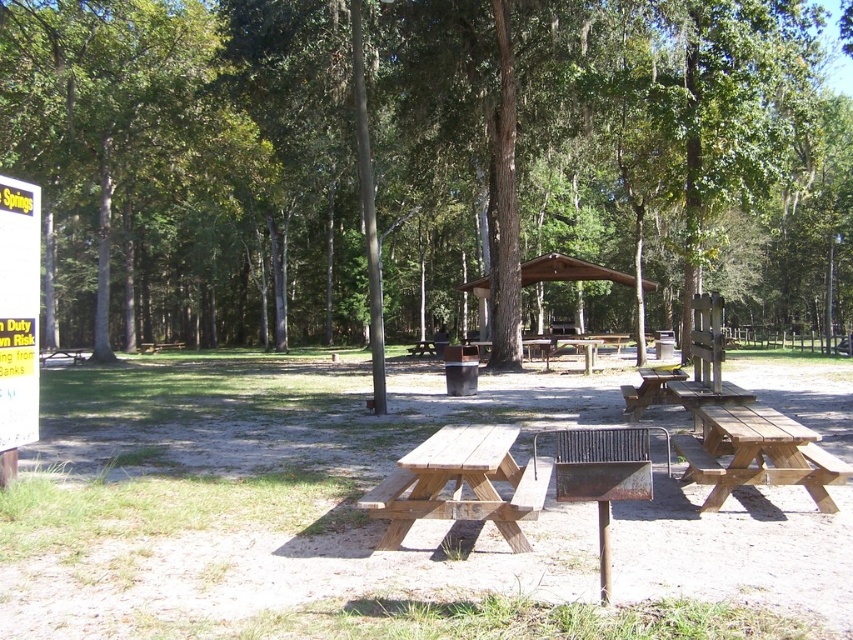
Who is lower down, brown wood tree at center or green leafy tree at left?

green leafy tree at left is below.

Can you confirm if brown wood tree at center is positioned to the right of green leafy tree at left?

Yes, brown wood tree at center is to the right of green leafy tree at left.

The height and width of the screenshot is (640, 853). What do you see at coordinates (422, 163) in the screenshot?
I see `brown wood tree at center` at bounding box center [422, 163].

Identify the location of brown wood tree at center. The image size is (853, 640). (422, 163).

Is point (488, 442) closer to viewer compared to point (706, 502)?

That is True.

You are a GUI agent. You are given a task and a screenshot of the screen. Output one action in this format:
    pyautogui.click(x=<x>, y=<y>)
    Task: Click on the natural wood picnic table at center
    
    Given the screenshot: What is the action you would take?
    pyautogui.click(x=460, y=483)

What do you see at coordinates (422, 163) in the screenshot?
I see `brown wood tree at center` at bounding box center [422, 163].

Which is below, brown wood tree at center or natural wood picnic table at center?

natural wood picnic table at center

Image resolution: width=853 pixels, height=640 pixels. What do you see at coordinates (422, 163) in the screenshot?
I see `brown wood tree at center` at bounding box center [422, 163].

Identify the location of brown wood tree at center. (422, 163).